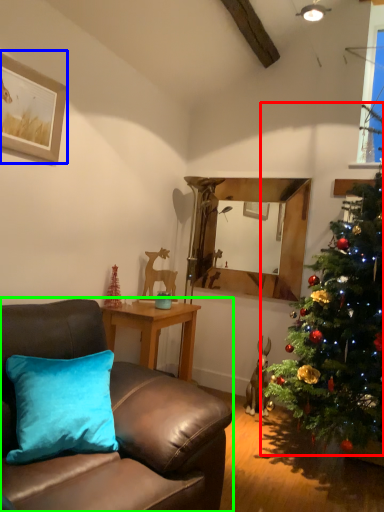
Question: Which is nearer to the christmas tree (highlighted by a red box)? picture frame (highlighted by a blue box) or studio couch (highlighted by a green box).

Choices:
 (A) picture frame
 (B) studio couch

Answer: (B)